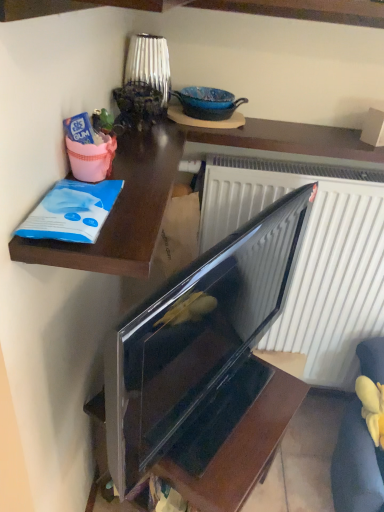
Question: Is the position of glossy black tv at lower right more distant than that of blue plastic bag at upper left?

Choices:
 (A) no
 (B) yes

Answer: (B)

Question: Is glossy black tv at lower right not inside blue plastic bag at upper left?

Choices:
 (A) yes
 (B) no

Answer: (A)

Question: Does glossy black tv at lower right lie in front of blue plastic bag at upper left?

Choices:
 (A) yes
 (B) no

Answer: (B)

Question: Is glossy black tv at lower right aimed at blue plastic bag at upper left?

Choices:
 (A) no
 (B) yes

Answer: (A)

Question: Would you say blue plastic bag at upper left is part of glossy black tv at lower right's contents?

Choices:
 (A) no
 (B) yes

Answer: (A)

Question: Does glossy black tv at lower right appear on the left side of blue plastic bag at upper left?

Choices:
 (A) yes
 (B) no

Answer: (B)

Question: Considering the relative sizes of glossy black tv at lower right and velvet yellow armchair at lower right in the image provided, is glossy black tv at lower right shorter than velvet yellow armchair at lower right?

Choices:
 (A) no
 (B) yes

Answer: (B)

Question: Can you confirm if glossy black tv at lower right is positioned to the right of velvet yellow armchair at lower right?

Choices:
 (A) no
 (B) yes

Answer: (A)

Question: Does glossy black tv at lower right have a lesser width compared to velvet yellow armchair at lower right?

Choices:
 (A) yes
 (B) no

Answer: (A)

Question: From the image's perspective, does glossy black tv at lower right appear lower than velvet yellow armchair at lower right?

Choices:
 (A) no
 (B) yes

Answer: (A)

Question: From a real-world perspective, is glossy black tv at lower right over velvet yellow armchair at lower right?

Choices:
 (A) no
 (B) yes

Answer: (A)

Question: Can you confirm if glossy black tv at lower right is taller than velvet yellow armchair at lower right?

Choices:
 (A) no
 (B) yes

Answer: (A)

Question: Is velvet yellow armchair at lower right wider than glossy black tv at lower right?

Choices:
 (A) yes
 (B) no

Answer: (A)